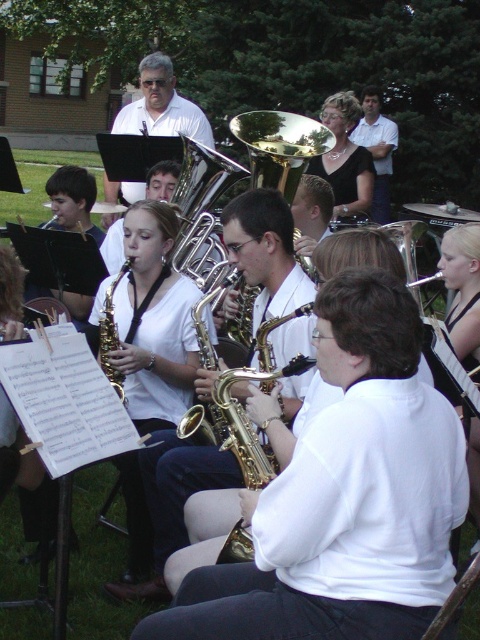
Question: Where is silver polished trumpet at center located in relation to gold shiny saxophone at center in the image?

Choices:
 (A) right
 (B) left

Answer: (A)

Question: In this image, where is brass shiny trumpet at center located relative to gold shiny saxophone at center?

Choices:
 (A) above
 (B) below

Answer: (A)

Question: Where is brass shiny trumpet at center located in relation to gold shiny saxophone at center in the image?

Choices:
 (A) above
 (B) below

Answer: (A)

Question: Among these objects, which one is farthest from the camera?

Choices:
 (A) gold shiny saxophone at center
 (B) silver polished trumpet at center
 (C) brass shiny trumpet at center

Answer: (C)

Question: Which of the following is the farthest from the observer?

Choices:
 (A) (192, 145)
 (B) (273, 186)

Answer: (A)

Question: Which point is closer to the camera taking this photo?

Choices:
 (A) (108, 380)
 (B) (237, 132)

Answer: (A)